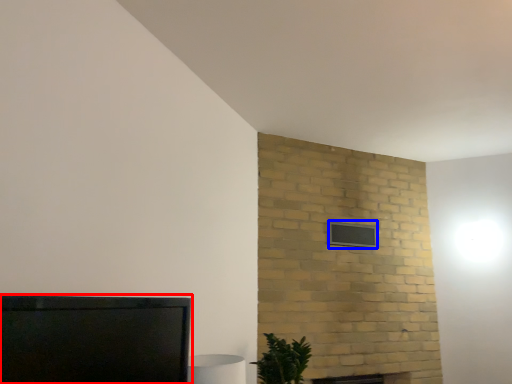
Question: Which object appears farthest to the camera in this image, furniture (highlighted by a red box) or window (highlighted by a blue box)?

Choices:
 (A) furniture
 (B) window

Answer: (B)